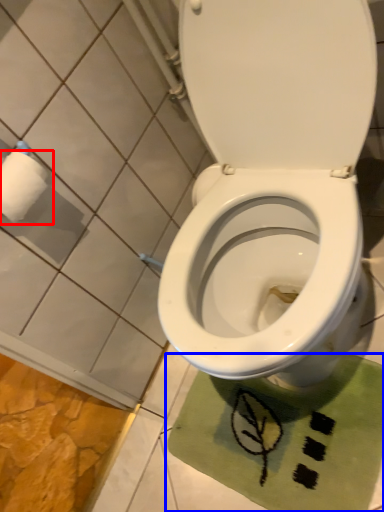
Question: Which object appears farthest to the camera in this image, toilet paper (highlighted by a red box) or bath mat (highlighted by a blue box)?

Choices:
 (A) toilet paper
 (B) bath mat

Answer: (B)